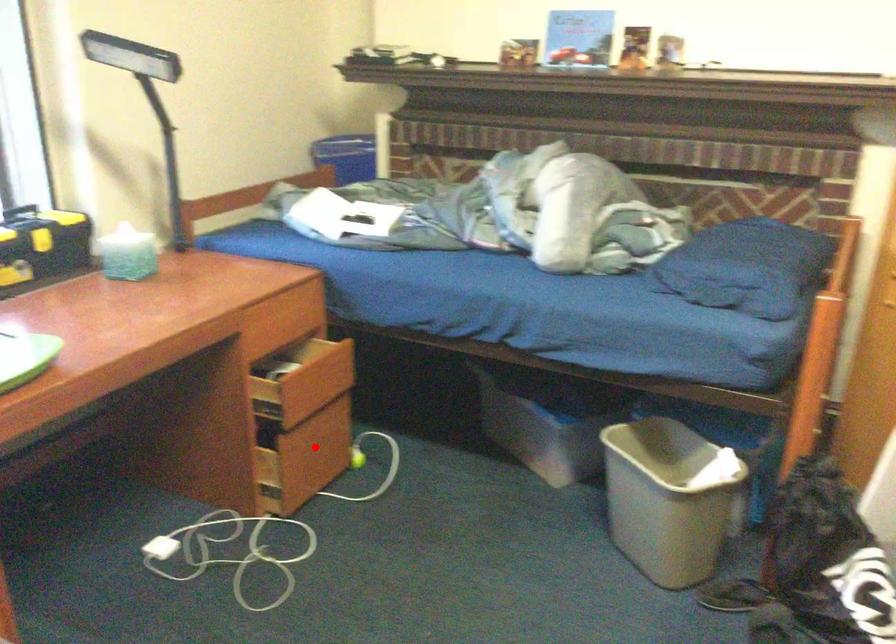
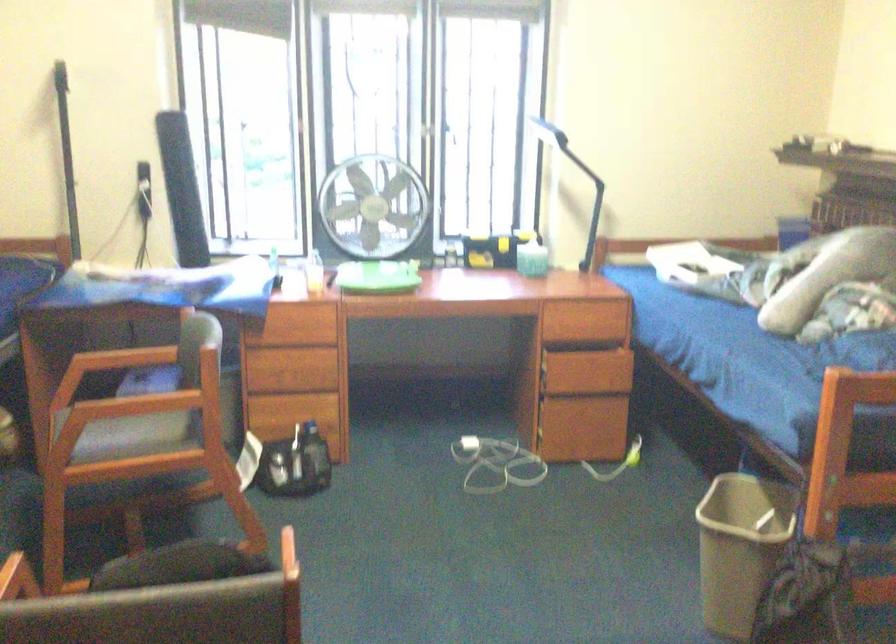
Question: I am providing you with two images of the same scene from different viewpoints. In image1, a red point is highlighted. Considering the same 3D point in image2, which of the following is correct?

Choices:
 (A) It is closer
 (B) It is farther

Answer: (B)